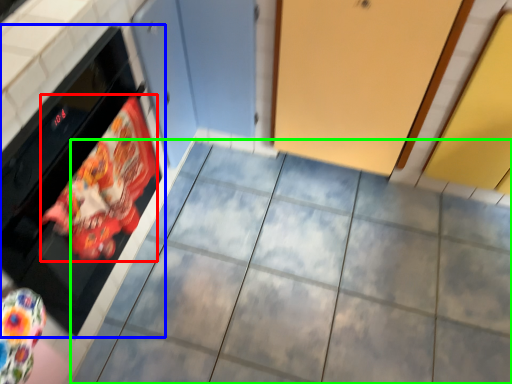
Question: Estimate the real-world distances between objects in this image. Which object is farther from material (highlighted by a red box), oven (highlighted by a blue box) or ceramic tile (highlighted by a green box)?

Choices:
 (A) oven
 (B) ceramic tile

Answer: (B)